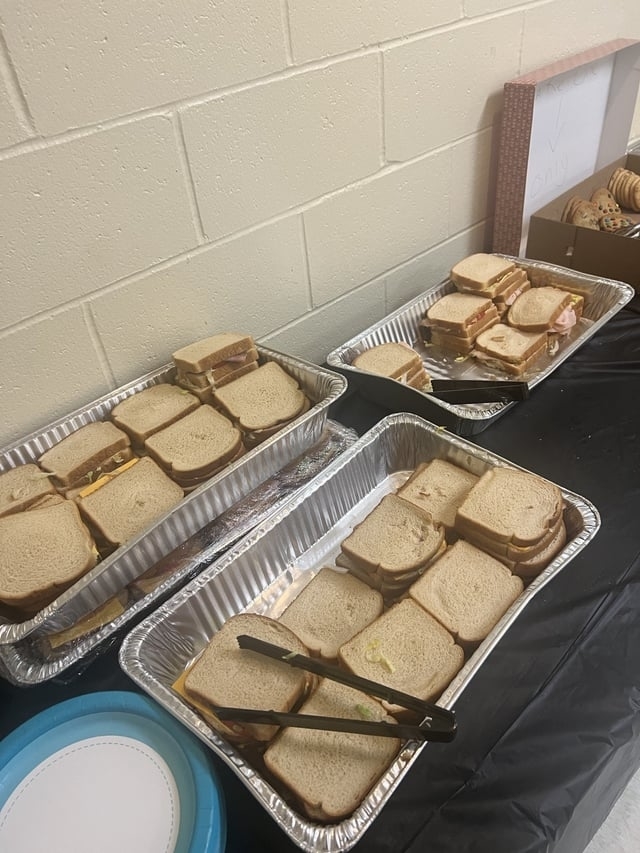
At what (x,y) coordinates should I click in order to perform the action: click on brick wall. Please return your answer as a coordinate pair (x, y). This screenshot has width=640, height=853. Looking at the image, I should click on (125, 346).